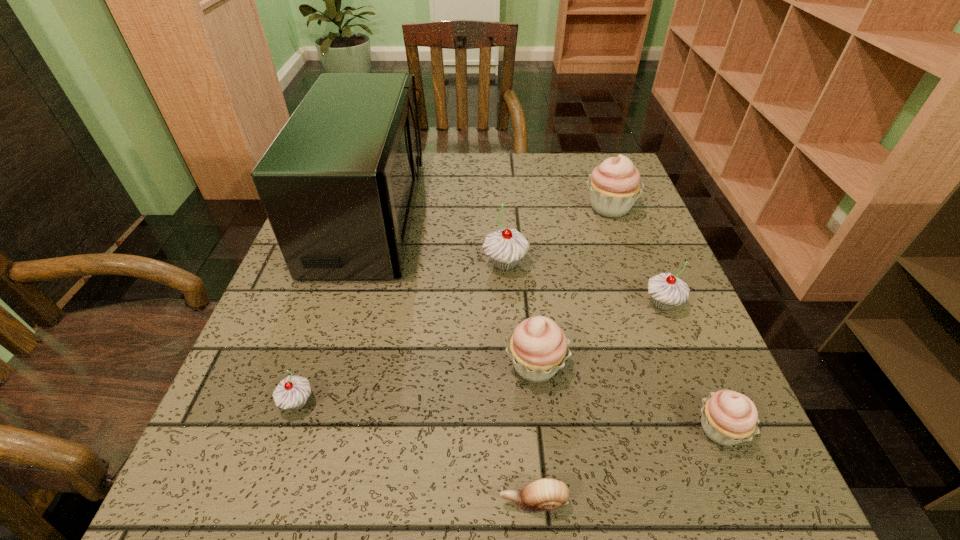
Where is `blank space located 0.270m on the right of the smallest gray cupcake`? blank space located 0.270m on the right of the smallest gray cupcake is located at coordinates (481, 402).

What are the coordinates of `vacant space located 0.140m on the left of the smallest pink cupcake` in the screenshot? It's located at (604, 429).

Locate an element on the screen. vacant point located 0.300m on the front-facing side of the escargot is located at coordinates (283, 502).

Locate an element on the screen. This screenshot has width=960, height=540. free spot located on the front-facing side of the escargot is located at coordinates (254, 502).

Find the location of `free space located on the front-facing side of the escargot`. free space located on the front-facing side of the escargot is located at coordinates (254, 502).

You are a GUI agent. You are given a task and a screenshot of the screen. Output one action in this format:
    pyautogui.click(x=<x>, y=<y>)
    Task: Click on the microwave_oven present at the far edge
    
    Given the screenshot: What is the action you would take?
    pyautogui.click(x=338, y=184)

Image resolution: width=960 pixels, height=540 pixels. I want to click on cupcake that is at the far edge, so click(614, 185).

Where is `object that is at the near edge`? The image size is (960, 540). object that is at the near edge is located at coordinates (545, 494).

Locate an element on the screen. The image size is (960, 540). microwave_oven present at the left edge is located at coordinates (338, 184).

Locate an element on the screen. This screenshot has width=960, height=540. cupcake at the left edge is located at coordinates (292, 392).